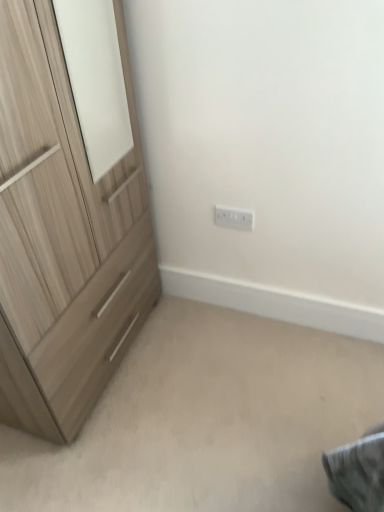
Question: Is white plastic electric outlet at center wider or thinner than light wood/texture chest of drawers at left?

Choices:
 (A) thin
 (B) wide

Answer: (A)

Question: In terms of size, does white plastic electric outlet at center appear bigger or smaller than light wood/texture chest of drawers at left?

Choices:
 (A) small
 (B) big

Answer: (A)

Question: Considering the positions of white plastic electric outlet at center and light wood/texture chest of drawers at left in the image, is white plastic electric outlet at center taller or shorter than light wood/texture chest of drawers at left?

Choices:
 (A) short
 (B) tall

Answer: (A)

Question: From a real-world perspective, is light wood/texture chest of drawers at left positioned above or below white plastic electric outlet at center?

Choices:
 (A) above
 (B) below

Answer: (A)

Question: In terms of height, does light wood/texture chest of drawers at left look taller or shorter compared to white plastic electric outlet at center?

Choices:
 (A) short
 (B) tall

Answer: (B)

Question: Considering the positions of light wood/texture chest of drawers at left and white plastic electric outlet at center in the image, is light wood/texture chest of drawers at left bigger or smaller than white plastic electric outlet at center?

Choices:
 (A) big
 (B) small

Answer: (A)

Question: Would you say light wood/texture chest of drawers at left is inside or outside white plastic electric outlet at center?

Choices:
 (A) inside
 (B) outside

Answer: (B)